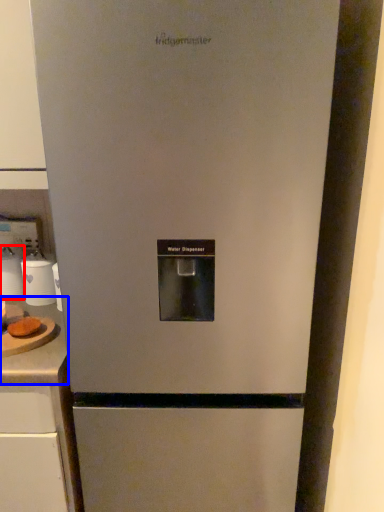
Question: Which object is closer to the camera taking this photo, appliance (highlighted by a red box) or counter top (highlighted by a blue box)?

Choices:
 (A) appliance
 (B) counter top

Answer: (B)